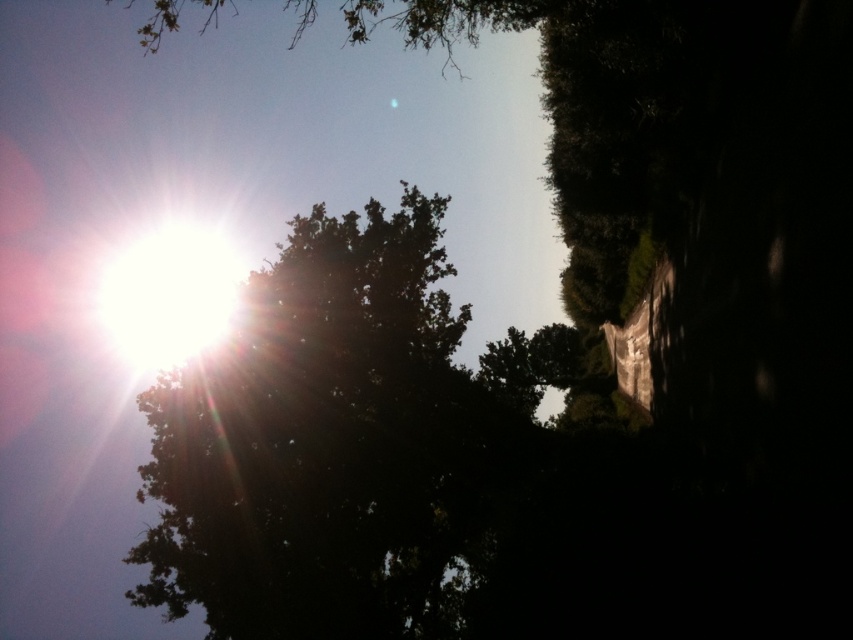
Who is lower down, dark green leafy tree at upper center or bright white sun at upper left?

dark green leafy tree at upper center

Does dark green leafy tree at upper center have a larger size compared to bright white sun at upper left?

Actually, dark green leafy tree at upper center might be smaller than bright white sun at upper left.

Find the location of `dark green leafy tree at upper center`. dark green leafy tree at upper center is located at coordinates (341, 444).

The height and width of the screenshot is (640, 853). Describe the element at coordinates (169, 294) in the screenshot. I see `bright white sun at upper left` at that location.

Which is behind, point (204, 344) or point (491, 3)?

Positioned behind is point (204, 344).

The height and width of the screenshot is (640, 853). Identify the location of bright white sun at upper left. (169, 294).

Which is behind, point (288, 308) or point (364, 26)?

The point (364, 26) is behind.

Describe the element at coordinates (341, 444) in the screenshot. This screenshot has height=640, width=853. I see `dark green leafy tree at upper center` at that location.

I want to click on dark green leafy tree at upper center, so click(x=341, y=444).